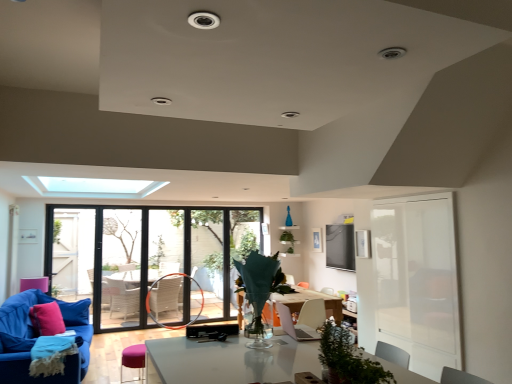
Question: Is pink fabric pillow at lower left thinner than velvet blue couch at lower left?

Choices:
 (A) yes
 (B) no

Answer: (A)

Question: From the image's perspective, is pink fabric pillow at lower left below velvet blue couch at lower left?

Choices:
 (A) no
 (B) yes

Answer: (A)

Question: Can you confirm if pink fabric pillow at lower left is shorter than velvet blue couch at lower left?

Choices:
 (A) no
 (B) yes

Answer: (B)

Question: Does pink fabric pillow at lower left touch velvet blue couch at lower left?

Choices:
 (A) yes
 (B) no

Answer: (B)

Question: Is pink fabric pillow at lower left positioned behind velvet blue couch at lower left?

Choices:
 (A) no
 (B) yes

Answer: (B)

Question: Can you confirm if pink fabric pillow at lower left is wider than velvet blue couch at lower left?

Choices:
 (A) no
 (B) yes

Answer: (A)

Question: Does clear glass window at center turn towards velvet blue couch at lower left?

Choices:
 (A) no
 (B) yes

Answer: (B)

Question: Can you see clear glass window at center touching velvet blue couch at lower left?

Choices:
 (A) yes
 (B) no

Answer: (B)

Question: From the image's perspective, does clear glass window at center appear higher than velvet blue couch at lower left?

Choices:
 (A) no
 (B) yes

Answer: (B)

Question: Are clear glass window at center and velvet blue couch at lower left far apart?

Choices:
 (A) no
 (B) yes

Answer: (B)

Question: Is velvet blue couch at lower left at the back of clear glass window at center?

Choices:
 (A) yes
 (B) no

Answer: (B)

Question: Is clear glass window at center further to the viewer compared to velvet blue couch at lower left?

Choices:
 (A) yes
 (B) no

Answer: (A)

Question: Can you confirm if velvet blue couch at lower left is thinner than pink fabric pillow at lower left?

Choices:
 (A) yes
 (B) no

Answer: (B)